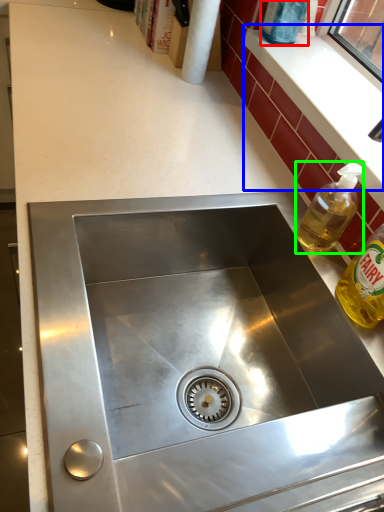
Question: Based on their relative distances, which object is farther from bottle (highlighted by a red box)? Choose from window sill (highlighted by a blue box) and bottle (highlighted by a green box).

Choices:
 (A) window sill
 (B) bottle

Answer: (B)